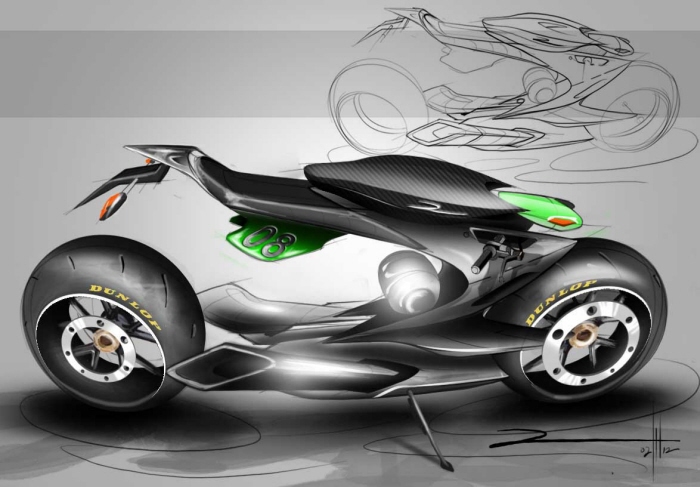
Locate an element on the screen. Image resolution: width=700 pixels, height=487 pixels. seat is located at coordinates [272, 190].